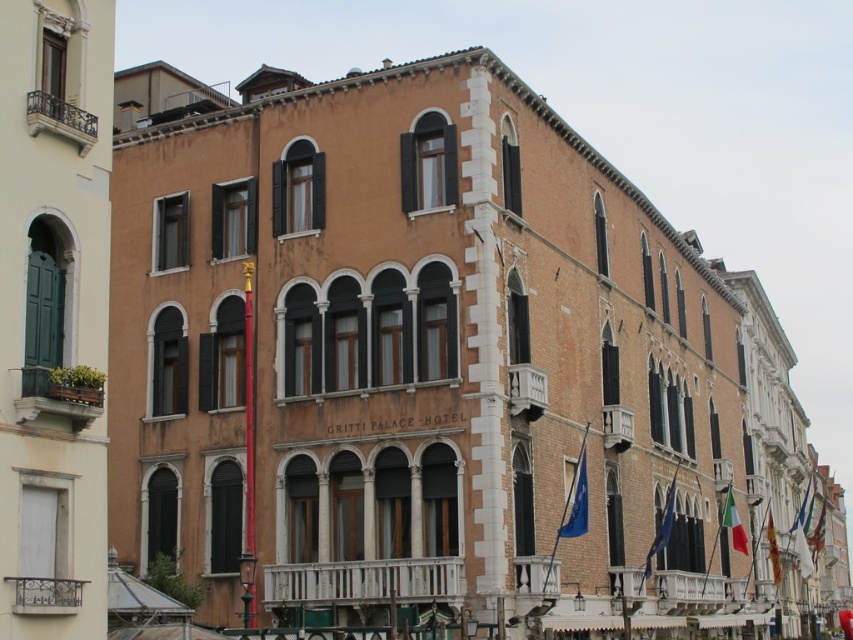
You are standing in front of the Gritti Palace Hotel and want to locate the blue fabric flag at lower center. According to the coordinates provided, where exactly is the flag positioned?

The blue fabric flag at lower center is positioned at coordinates point (577, 502).

You are standing in front of the Gritti Palace Hotel. There is a blue fabric flag at lower center. Where is the blue fabric flag located in relation to the building?

The blue fabric flag at lower center is located at the lower part of the building, near the center, as indicated by its 2D coordinates at point 0.786 on the x axis and 0.678 on the y axis.

You are a tourist standing in front of the Gritti Palace Hotel and notice two flags. The first is the italian flag at center, and the second is the green fabric flag at lower right. Which flag is located to the left when viewed from your perspective?

The italian flag at center is positioned on the left side of green fabric flag at lower right, so it is located to the left when viewed from your perspective.